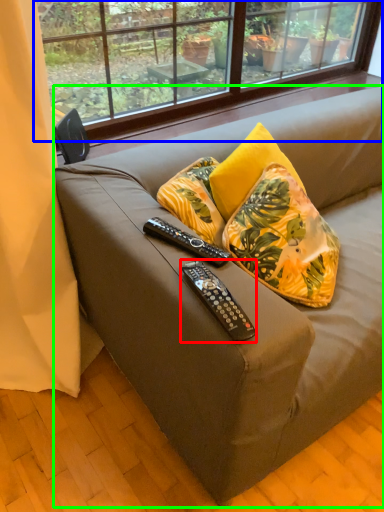
Question: Which object is the farthest from remote control (highlighted by a red box)? Choose among these: window (highlighted by a blue box) or studio couch (highlighted by a green box).

Choices:
 (A) window
 (B) studio couch

Answer: (A)